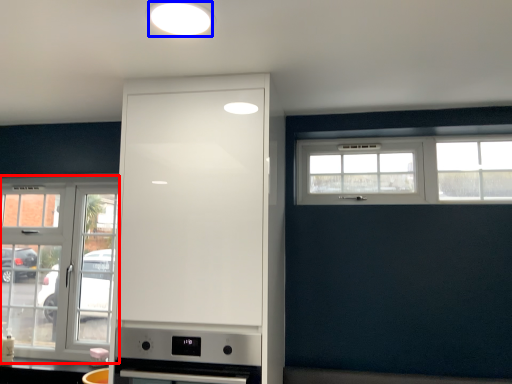
Question: Which object is further to the camera taking this photo, window (highlighted by a red box) or lighting (highlighted by a blue box)?

Choices:
 (A) window
 (B) lighting

Answer: (A)